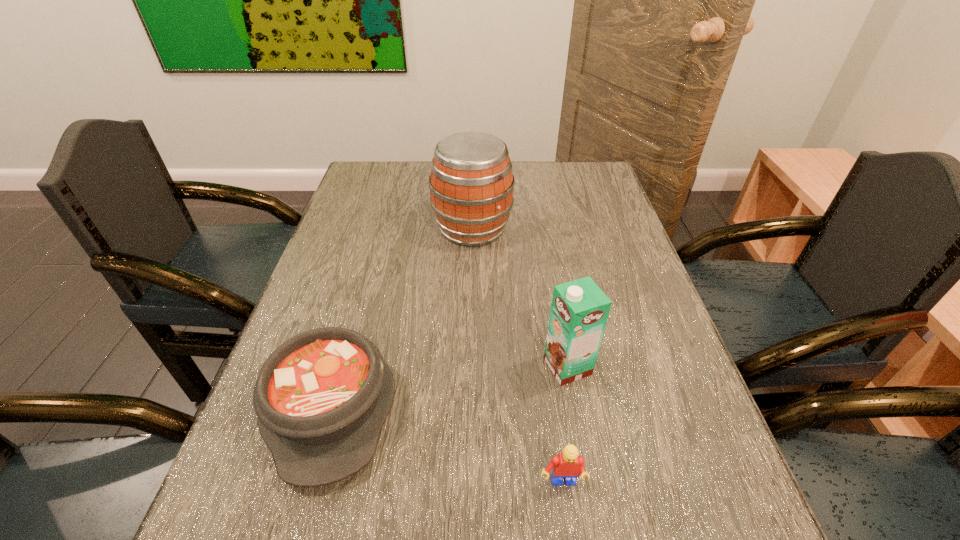
Locate an element on the screen. The image size is (960, 540). free space that is in between the Lego and the carton is located at coordinates (564, 425).

Find the location of a particular element. Image resolution: width=960 pixels, height=540 pixels. free area in between the carton and the farthest object is located at coordinates (520, 298).

I want to click on vacant area that lies between the second object from left to right and the casserole, so click(x=401, y=316).

This screenshot has height=540, width=960. I want to click on empty space between the Lego and the carton, so click(564, 425).

Identify which object is the third closest to the second object from left to right. Please provide its 2D coordinates. Your answer should be formatted as a tuple, i.e. [(x, y)], where the tuple contains the x and y coordinates of a point satisfying the conditions above.

[(567, 464)]

Image resolution: width=960 pixels, height=540 pixels. I want to click on object identified as the closest to the Lego, so tap(579, 311).